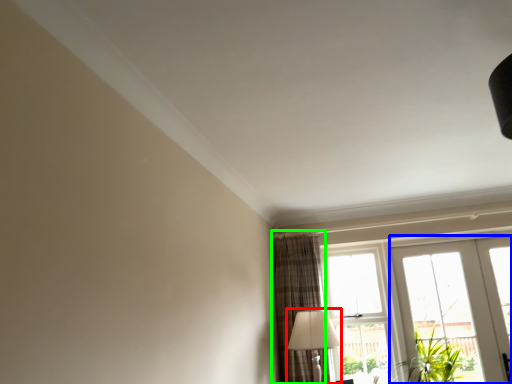
Question: Which is farther away from table lamp (highlighted by a red box)? door (highlighted by a blue box) or curtain (highlighted by a green box)?

Choices:
 (A) door
 (B) curtain

Answer: (A)